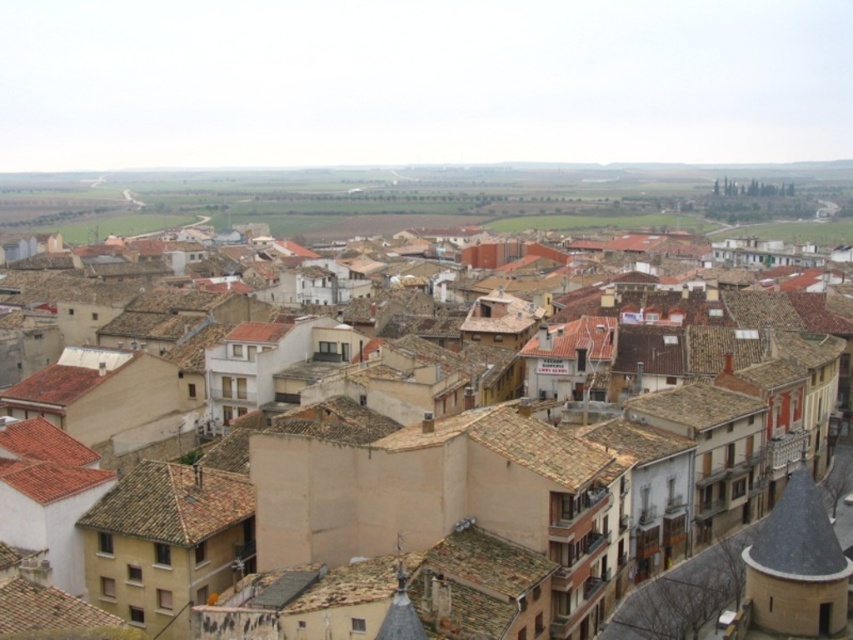
Locate an element on the screen. brown tile roof at center is located at coordinates (511, 493).